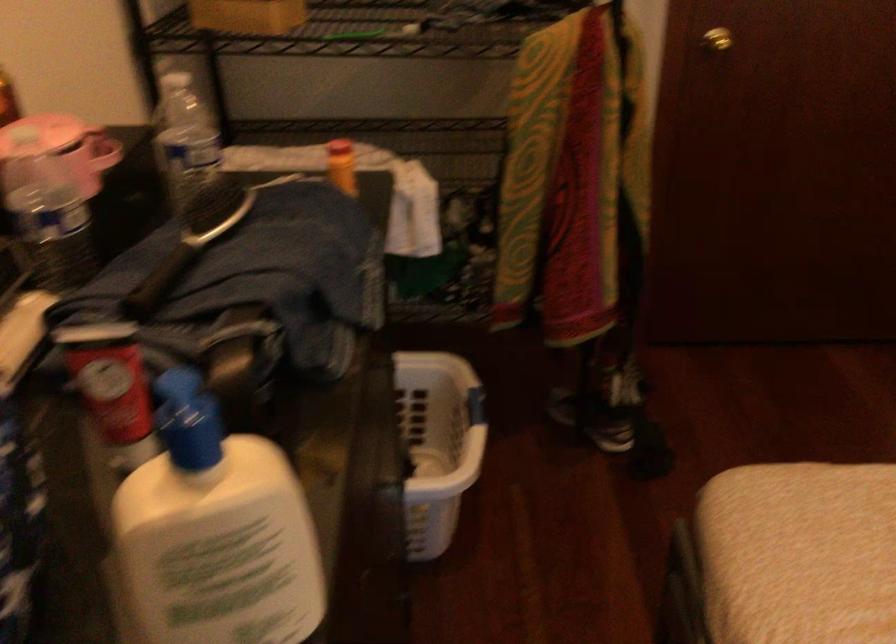
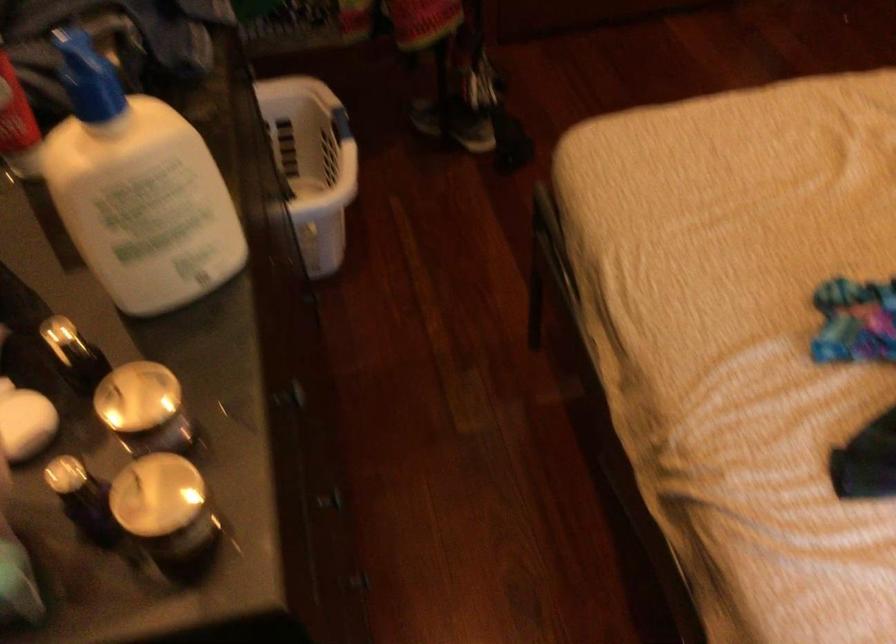
Question: The first image is from the beginning of the video and the second image is from the end. How did the camera likely rotate when shooting the video?

Choices:
 (A) Left
 (B) Right
 (C) Up
 (D) Down

Answer: (D)